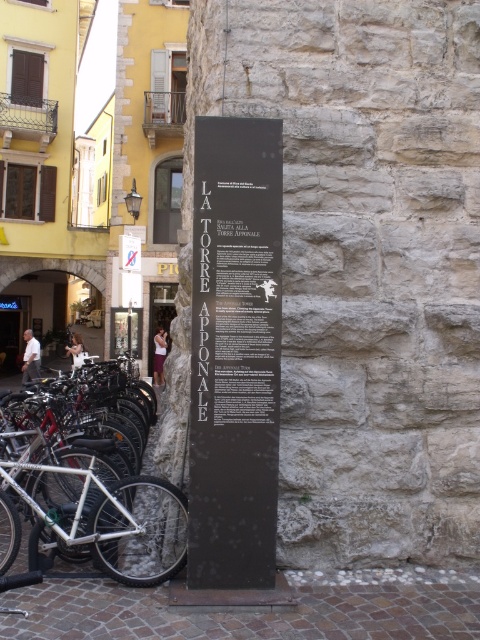
Can you confirm if black polished stone sign at center is bigger than silver metallic bicycle at left?

Incorrect, black polished stone sign at center is not larger than silver metallic bicycle at left.

Is black polished stone sign at center positioned in front of silver metallic bicycle at left?

Yes, it is.

Measure the distance between black polished stone sign at center and camera.

They are 3.91 meters apart.

I want to click on black polished stone sign at center, so click(x=235, y=353).